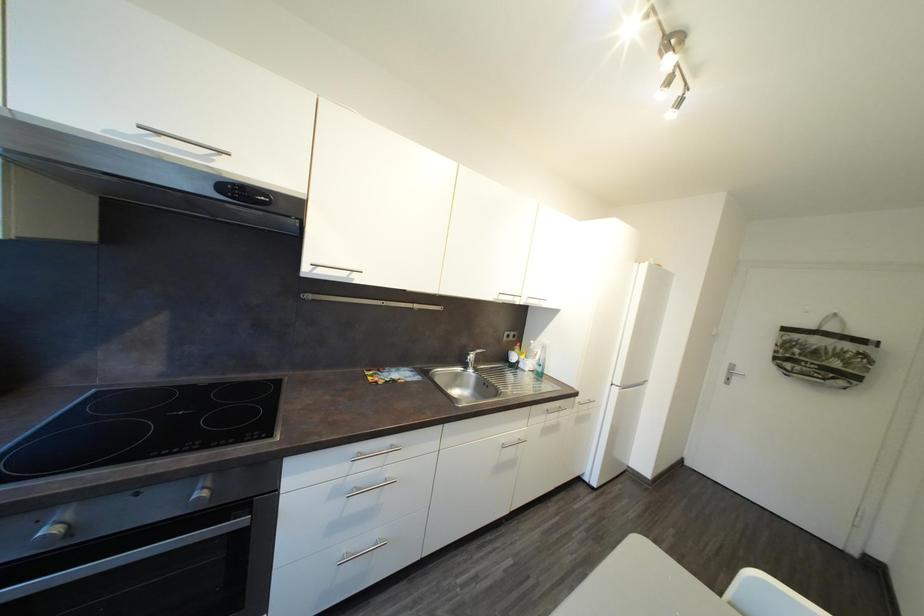
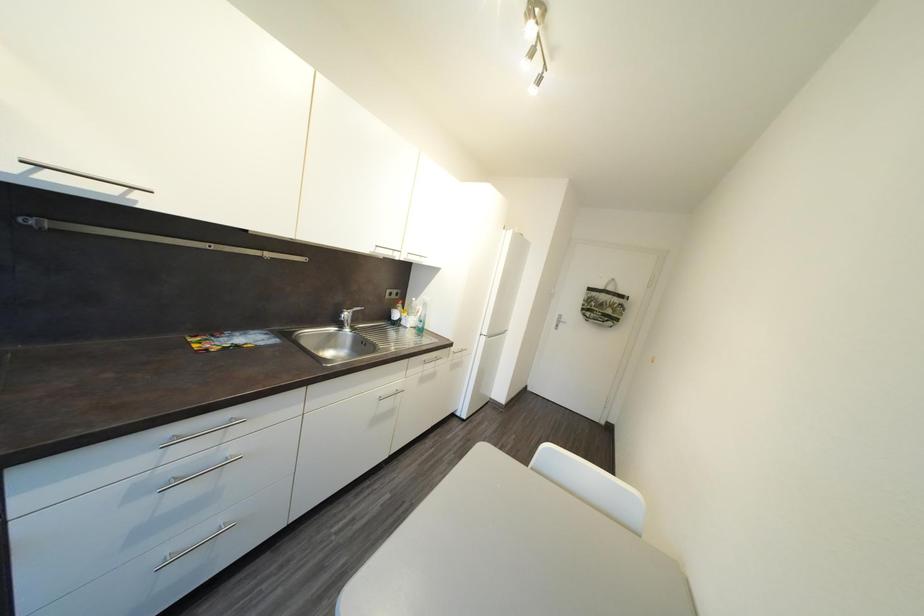
Question: The first image is from the beginning of the video and the second image is from the end. How did the camera likely rotate when shooting the video?

Choices:
 (A) Left
 (B) Right
 (C) Up
 (D) Down

Answer: (B)